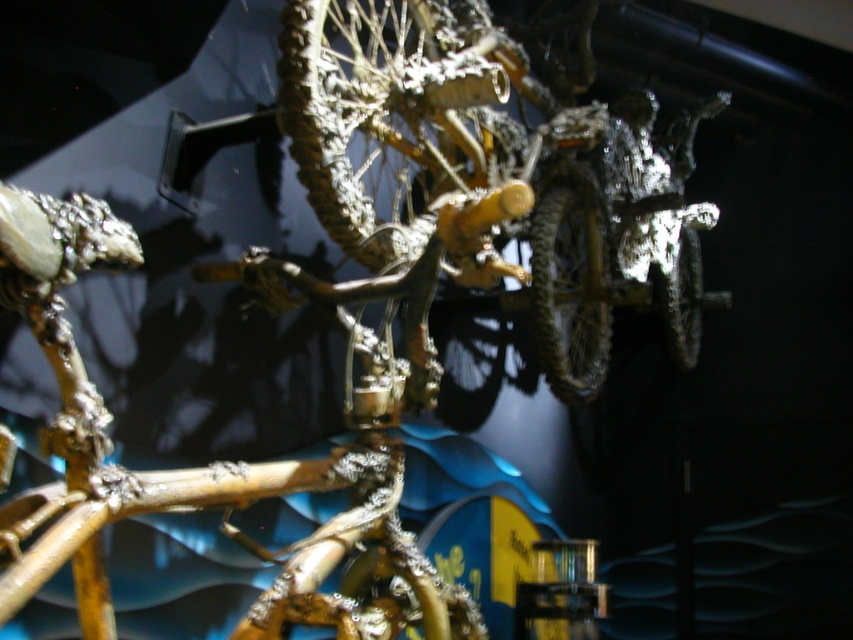
Question: Is metallic gold bicycle tire at upper center to the left of metallic gold tire at center from the viewer's perspective?

Choices:
 (A) yes
 (B) no

Answer: (A)

Question: Which object is closer to the camera taking this photo?

Choices:
 (A) gold metallic bicycle at center
 (B) metallic silver tire at right

Answer: (A)

Question: Among these objects, which one is farthest from the camera?

Choices:
 (A) metallic silver tire at right
 (B) metallic gold bicycle tire at upper center
 (C) metallic gold tire at center
 (D) gold metallic bicycle at center

Answer: (A)

Question: In this image, where is metallic gold bicycle tire at upper center located relative to metallic gold tire at center?

Choices:
 (A) above
 (B) below

Answer: (A)

Question: Which point is closer to the camera?

Choices:
 (A) gold metallic bicycle at center
 (B) metallic silver tire at right
 (C) metallic gold bicycle tire at upper center

Answer: (A)

Question: Can you confirm if metallic gold bicycle tire at upper center is wider than metallic silver tire at right?

Choices:
 (A) no
 (B) yes

Answer: (B)